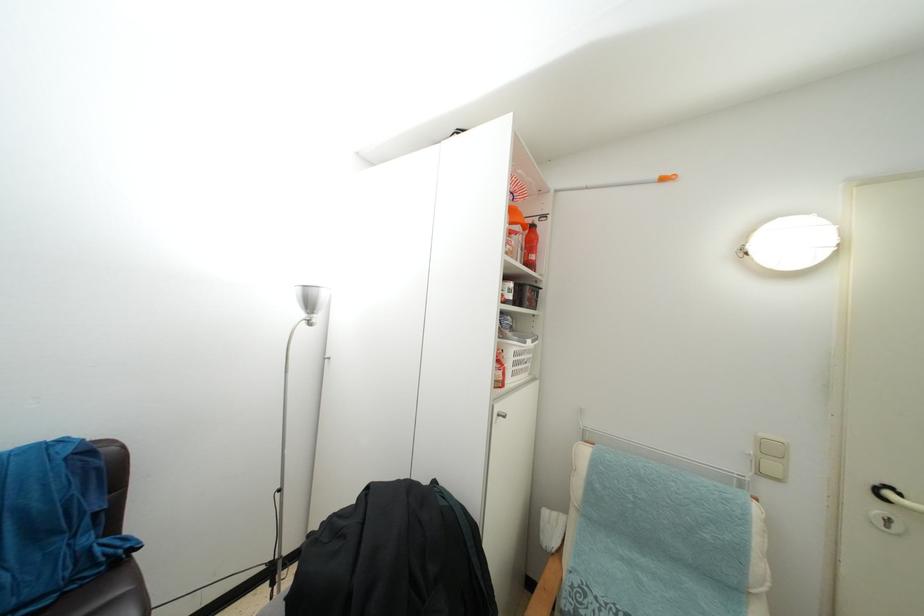
Where is `white plastic basket`? The height and width of the screenshot is (616, 924). white plastic basket is located at coordinates (513, 357).